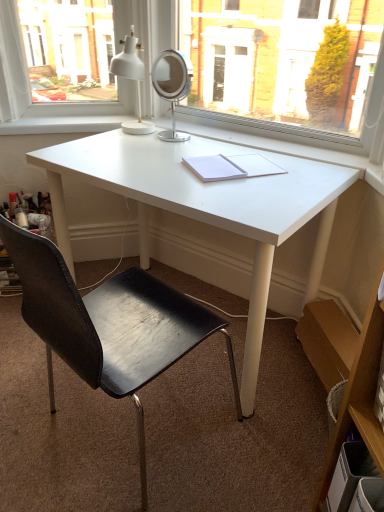
Where is `empty space that is ontop of white matte desk at center (from a real-world perspective)`? The width and height of the screenshot is (384, 512). empty space that is ontop of white matte desk at center (from a real-world perspective) is located at coordinates (183, 158).